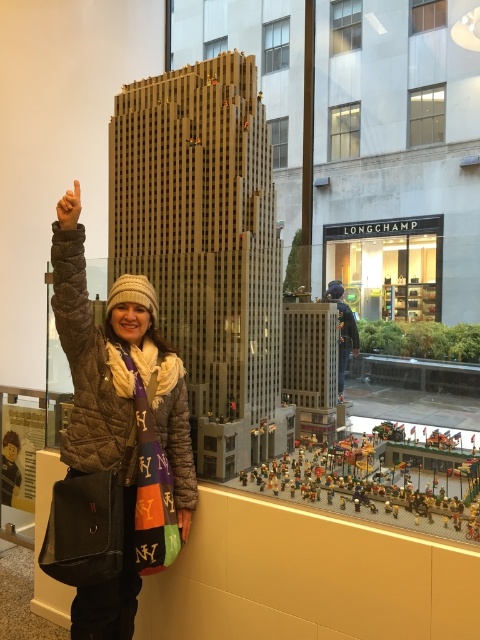
Question: Considering the real-world distances, which object is farthest from the brown matte hand at upper left?

Choices:
 (A) brown fuzzy coat at upper left
 (B) brown fuzzy jacket at upper left

Answer: (B)

Question: Which object appears farthest from the camera in this image?

Choices:
 (A) matte black hand at upper left
 (B) brown matte hand at upper left
 (C) brown fuzzy jacket at upper left

Answer: (C)

Question: Can you confirm if brown fuzzy jacket at upper left is smaller than matte black hand at upper left?

Choices:
 (A) no
 (B) yes

Answer: (A)

Question: Does brown quilted jacket at left have a greater width compared to brown fuzzy coat at upper left?

Choices:
 (A) yes
 (B) no

Answer: (A)

Question: Which is nearer to the brown fuzzy jacket at upper left?

Choices:
 (A) matte black hand at upper left
 (B) brown matte hand at upper left

Answer: (A)

Question: Can you confirm if brown fuzzy coat at upper left is positioned below matte black hand at upper left?

Choices:
 (A) no
 (B) yes

Answer: (A)